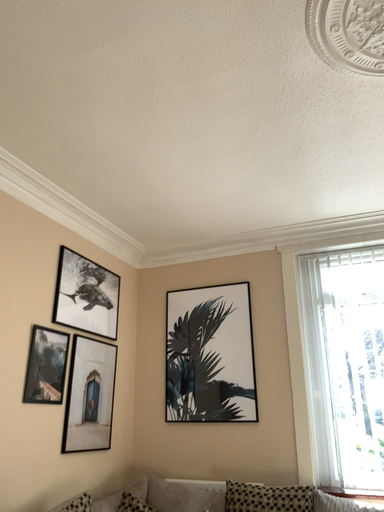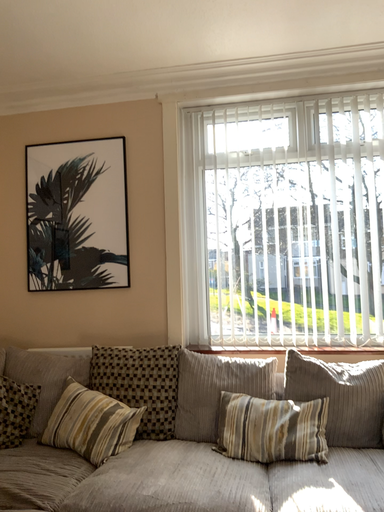
Question: How did the camera likely rotate when shooting the video?

Choices:
 (A) rotated left
 (B) rotated right

Answer: (B)